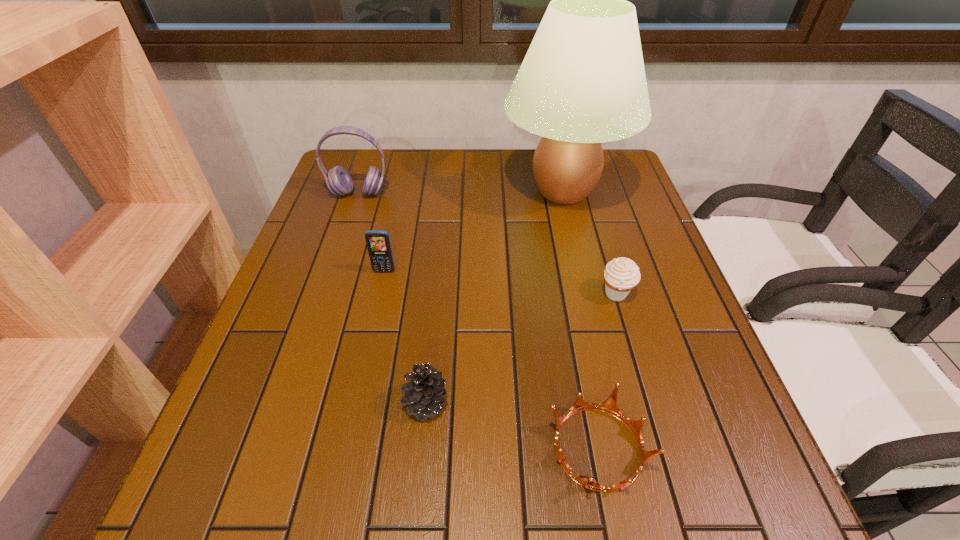
You are a GUI agent. You are given a task and a screenshot of the screen. Output one action in this format:
    pyautogui.click(x=<x>, y=<y>)
    Task: Click on the vacant space situated 0.270m on the shade of the lampshade
    
    Given the screenshot: What is the action you would take?
    pyautogui.click(x=406, y=191)

Find the location of a particular element. Image resolution: width=960 pixels, height=540 pixels. vacant space situated on the headband and ear cups of the leftmost object is located at coordinates (331, 275).

You are a GUI agent. You are given a task and a screenshot of the screen. Output one action in this format:
    pyautogui.click(x=<x>, y=<y>)
    Task: Click on the free space located on the screen of the cellular telephone
    
    Given the screenshot: What is the action you would take?
    pyautogui.click(x=371, y=332)

Where is `vacant space located 0.070m on the right of the third object from left to right`? This screenshot has width=960, height=540. vacant space located 0.070m on the right of the third object from left to right is located at coordinates (487, 403).

Image resolution: width=960 pixels, height=540 pixels. Find the location of `vacant space situated on the left of the muffin`. vacant space situated on the left of the muffin is located at coordinates (465, 294).

The height and width of the screenshot is (540, 960). What are the coordinates of `free space located 0.260m on the left of the crown` in the screenshot? It's located at (393, 448).

Identify the location of lampshade at the far edge. (582, 82).

You are a GUI agent. You are given a task and a screenshot of the screen. Output one action in this format:
    pyautogui.click(x=<x>, y=<y>)
    Task: Click on the headset that is at the far edge
    This screenshot has height=540, width=960.
    Given the screenshot: What is the action you would take?
    pyautogui.click(x=338, y=180)

Locate an element on the screen. This screenshot has height=540, width=960. object at the near edge is located at coordinates (609, 406).

The height and width of the screenshot is (540, 960). In order to click on object at the left edge in this screenshot , I will do `click(338, 180)`.